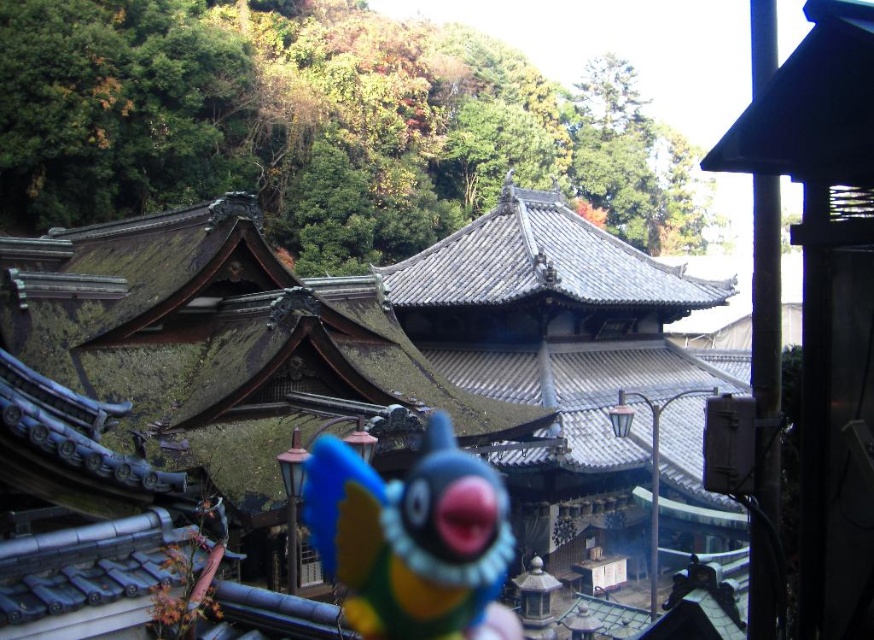
You are a photographer holding a camera with a 10cm wide lens. You want to capture both the rusty metal roof at center and the plush blue bird at center in the same frame. Can you fit both objects side by side without moving the camera?

The rusty metal roof at center might be wider than the plush blue bird at center. Since the lens is only 10cm wide, it depends on the actual width of the roof. If the roof is wider than 10cm, it may not fit entirely in the frame along with the bird.

You are a photographer standing in front of the traditional Japanese buildings. You want to take a photo that includes both the rusty metal roof at center and the plush blue bird at center. Which object will appear larger in the photo?

The rusty metal roof at center will appear larger in the photo because it is much taller than the plush blue bird at center.

You are standing in the traditional Japanese temple complex and notice a specific point in the scene. Can you identify what object is located at the coordinates point (274,385)?

The point (274,385) corresponds to the rusty metal roof at center.